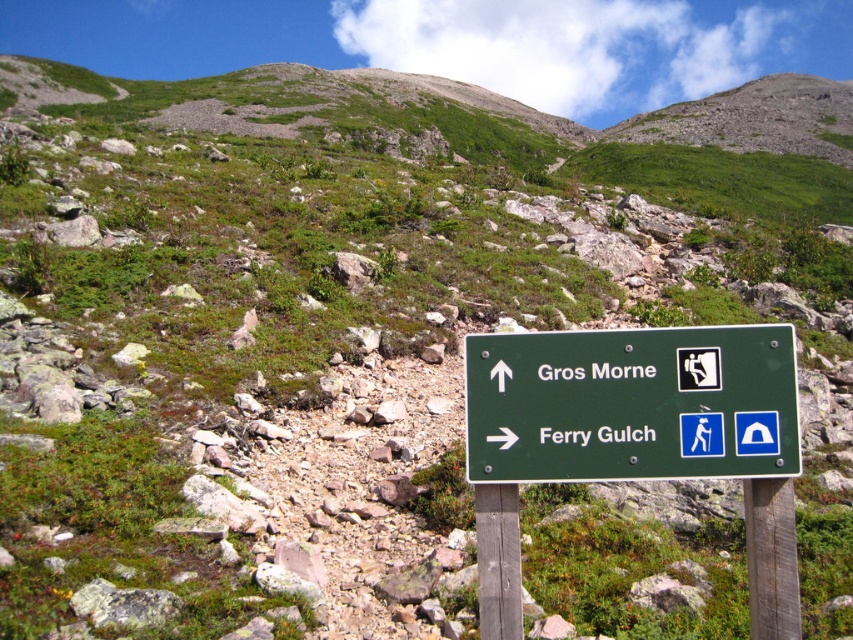
Looking at this image, you are a hiker trying to reach the Gros Morne trailhead. You see the green wooden signpost at center. According to the map, the trailhead is located at point 0.75, 0.75. Is the signpost near the trailhead?

The green wooden signpost at center is located at point (635, 440), which is very close to the trailhead at (639, 480). Therefore, the signpost is near the trailhead.

You are a hiker planning to reach the summit of Gros Morne. You see the green wooden signpost at center and the brown wooden pole at center ahead. Which object should you approach first to stay on the correct path?

You should approach the green wooden signpost at center first because it is closer to you than the brown wooden pole at center, so it is the first marker on the path.

You are a hiker trying to follow the trail to Gros Morne. You see the green plastic sign at center mounted on the brown wooden pole at center. According to the sign, which direction should you head?

The green plastic sign at center indicates that you should head upwards towards Gros Morne as the arrow points upwards and the icon shows a person descending stairs, implying the trail leads to that destination.